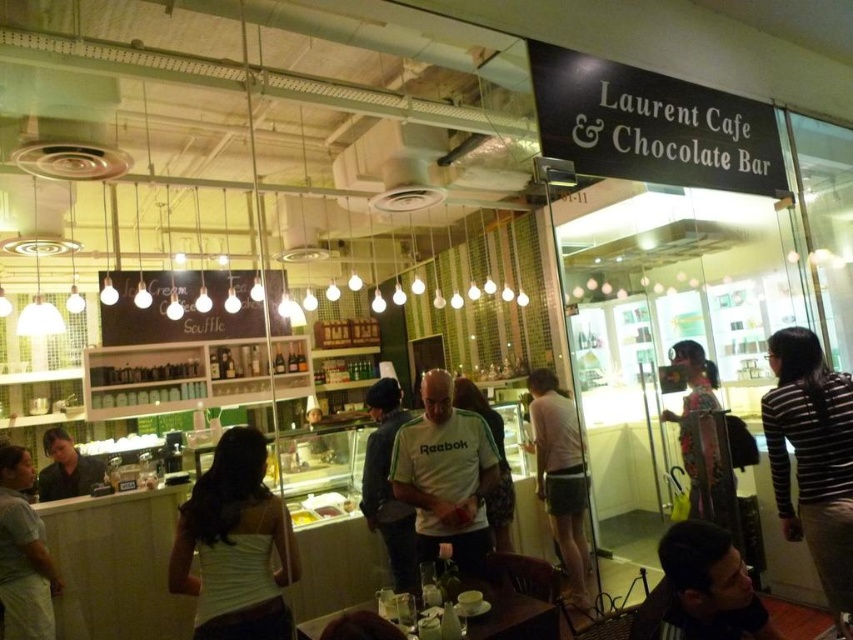
Who is positioned more to the left, white cotton shirt at center or white fabric shirt at lower center?

From the viewer's perspective, white fabric shirt at lower center appears more on the left side.

Is white cotton shirt at center below white fabric shirt at lower center?

Correct, white cotton shirt at center is located below white fabric shirt at lower center.

You are a GUI agent. You are given a task and a screenshot of the screen. Output one action in this format:
    pyautogui.click(x=<x>, y=<y>)
    Task: Click on the white cotton shirt at center
    The height and width of the screenshot is (640, 853).
    Given the screenshot: What is the action you would take?
    pyautogui.click(x=560, y=476)

Can you confirm if white fabric tank top at center is shorter than white reebok shirt at center?

Yes.

Describe the element at coordinates (235, 545) in the screenshot. The image size is (853, 640). I see `white fabric tank top at center` at that location.

Identify the location of white fabric tank top at center. (235, 545).

Is striped sweater at right closer to camera compared to white reebok shirt at center?

Yes, it is.

Who is lower down, striped sweater at right or white reebok shirt at center?

white reebok shirt at center is below.

I want to click on striped sweater at right, so click(x=811, y=458).